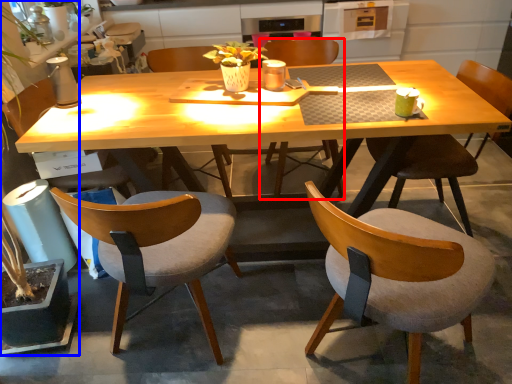
Question: Which of the following is the closest to the observer, chair (highlighted by a red box) or houseplant (highlighted by a blue box)?

Choices:
 (A) chair
 (B) houseplant

Answer: (B)